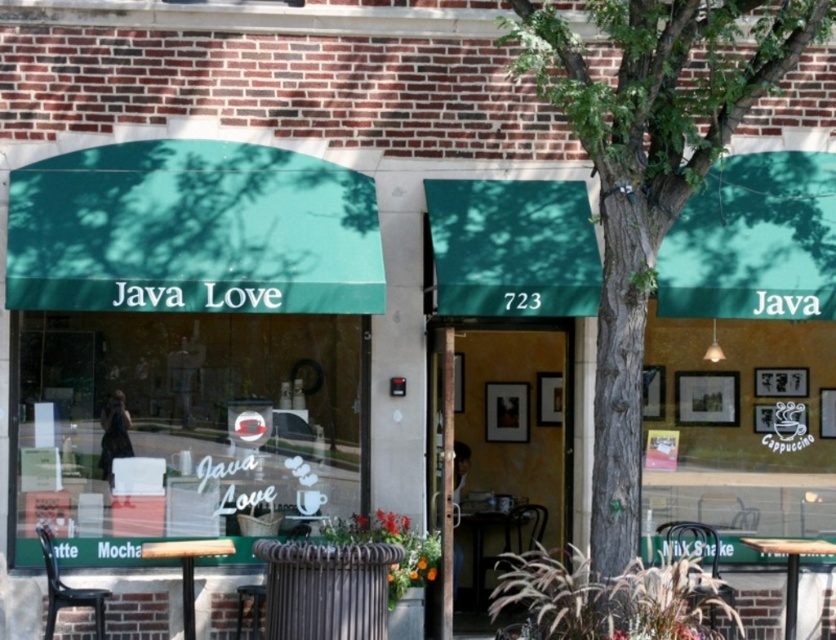
You are a customer standing at the entrance of Java Love. You see the green textured tree at center and the wooden table at lower left. Which object is bigger?

The green textured tree at center is larger in size than the wooden table at lower left.

You are a customer looking for a place to sit outside the Java Love cafe. You see the green textured tree at center and the wooden table at lower right. Which object is closer to the entrance of the cafe?

The wooden table at lower right is closer to the entrance of the cafe because the green textured tree at center is positioned on the left side of the wooden table at lower right, meaning the table is between the entrance and the tree.

You are standing at the point marked as point (x=625, y=557). The entrance to Java Love is 7.41 meters away from you. If you walk straight towards the entrance, will you pass through the green awning first or the brick facade first?

Since the entrance to Java Love is 7.41 meters away from point (x=625, y=557), walking straight towards it would mean you would first encounter the green awning before the brick facade, as the awning is part of the entrance structure and extends outward from the brick facade.